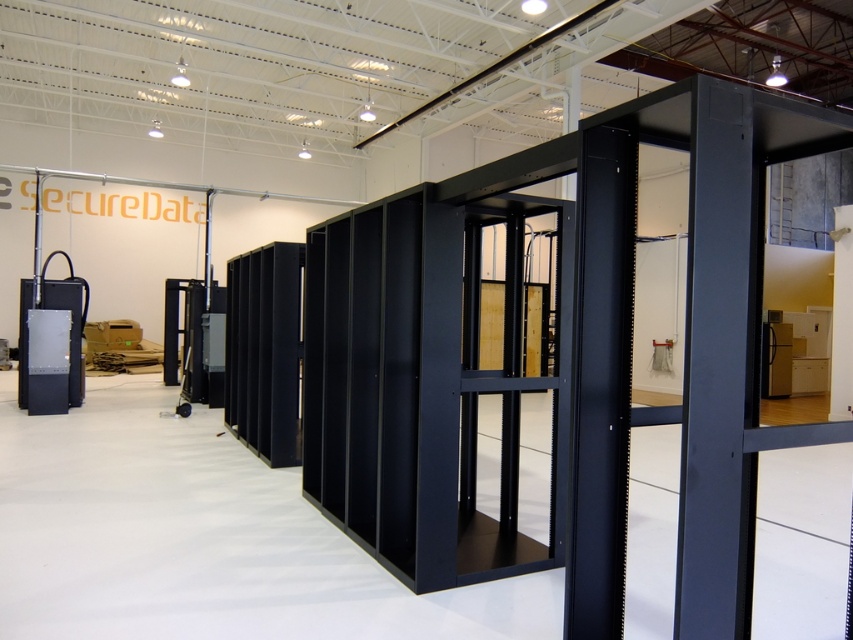
You are standing in the server room and want to exit through the transparent glass door at center. Based on the room layout, can you estimate the direction you should walk to reach it?

The transparent glass door at center is located at point (514, 384) in 2D coordinates, so you should walk towards the center of the room to reach it.

You are a technician entering the server room and need to locate the transparent glass door at center and the black metallic sensor at left. Which object is taller?

The transparent glass door at center is taller than the black metallic sensor at left.